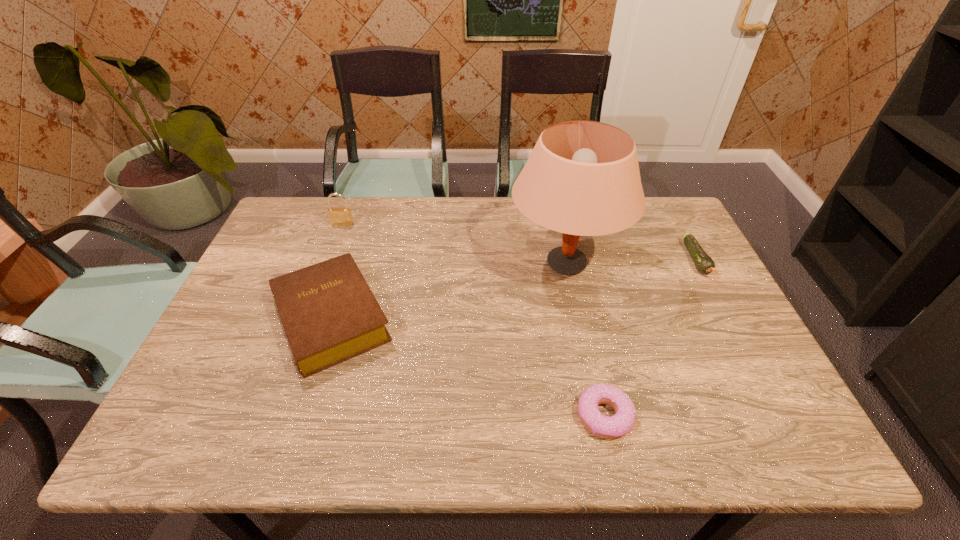
Where is `vacant region that satisfies the following two spatial constraints: 1. on the front-facing side of the tallest object; 2. on the front side of the Bible`? vacant region that satisfies the following two spatial constraints: 1. on the front-facing side of the tallest object; 2. on the front side of the Bible is located at coordinates (577, 319).

This screenshot has width=960, height=540. I want to click on free space in the image that satisfies the following two spatial constraints: 1. on the front-facing side of the farthest object; 2. on the right side of the nearest object, so click(x=272, y=416).